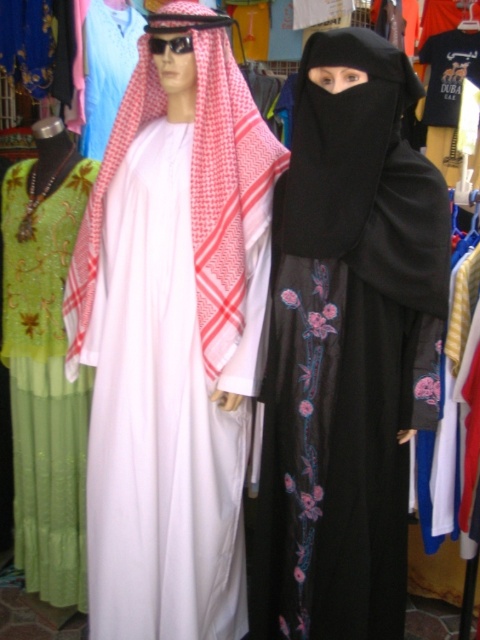
Is white matte kandura at center positioned at the back of green sequined dress at left?

No.

In the scene shown: Can you confirm if white matte kandura at center is taller than green sequined dress at left?

Yes, white matte kandura at center is taller than green sequined dress at left.

Which is in front, point (115, 609) or point (14, 369)?

Point (115, 609) is in front.

This screenshot has height=640, width=480. Identify the location of white matte kandura at center. point(172,336).

In the scene shown: Does black matte niqab at center have a greater height compared to green sequined dress at left?

Yes.

Does black matte niqab at center appear over green sequined dress at left?

Yes, black matte niqab at center is above green sequined dress at left.

At what (x,y) coordinates should I click in order to perform the action: click on black matte niqab at center. Please return your answer as a coordinate pair (x, y). This screenshot has height=640, width=480. Looking at the image, I should click on (347, 349).

Between point (135, 282) and point (435, 252), which one is positioned behind?

Point (135, 282)

Is white matte kandura at center in front of black matte niqab at center?

No, white matte kandura at center is behind black matte niqab at center.

Which is behind, point (153, 70) or point (340, 244)?

The point (153, 70) is more distant.

The width and height of the screenshot is (480, 640). I want to click on white matte kandura at center, so click(x=172, y=336).